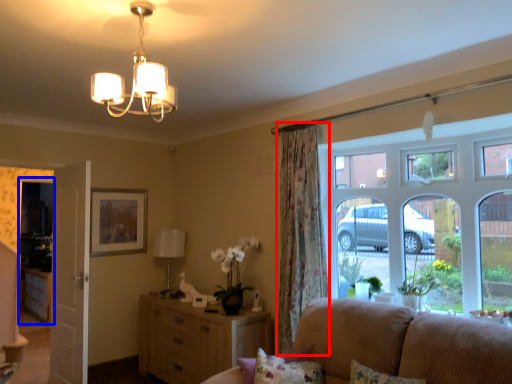
Question: Which of the following is the closest to the observer, curtain (highlighted by a red box) or glass door (highlighted by a blue box)?

Choices:
 (A) curtain
 (B) glass door

Answer: (A)